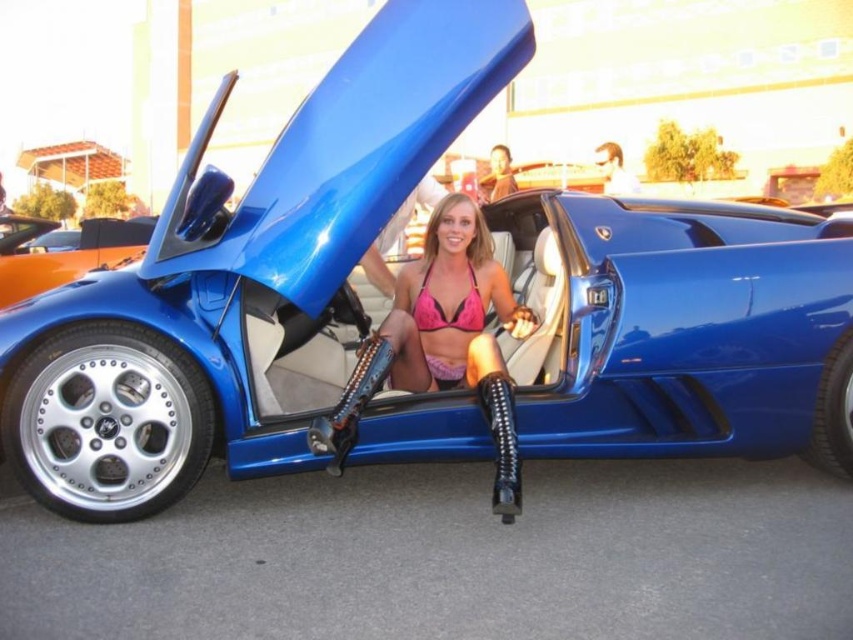
Is blue metallic car door at upper left further to the viewer compared to pink matte bikini top at center?

Yes, it is behind pink matte bikini top at center.

Can you confirm if blue metallic car door at upper left is positioned below pink matte bikini top at center?

Actually, blue metallic car door at upper left is above pink matte bikini top at center.

What do you see at coordinates (62, 252) in the screenshot?
I see `blue metallic car door at upper left` at bounding box center [62, 252].

At what (x,y) coordinates should I click in order to perform the action: click on blue metallic car door at upper left. Please return your answer as a coordinate pair (x, y). The width and height of the screenshot is (853, 640). Looking at the image, I should click on (62, 252).

Does pink bikini top at center appear over blue metallic car door at upper left?

No.

Does pink bikini top at center have a larger size compared to blue metallic car door at upper left?

Actually, pink bikini top at center might be smaller than blue metallic car door at upper left.

Describe the element at coordinates (450, 305) in the screenshot. I see `pink bikini top at center` at that location.

Locate an element on the screen. pink bikini top at center is located at coordinates (450, 305).

Who is higher up, pink bikini top at center or pink matte bikini top at center?

pink bikini top at center is higher up.

Is the position of pink bikini top at center more distant than that of pink matte bikini top at center?

No, it is not.

Is point (515, 301) less distant than point (461, 314)?

No, it is not.

Find the location of a particular element. The width and height of the screenshot is (853, 640). pink bikini top at center is located at coordinates (450, 305).